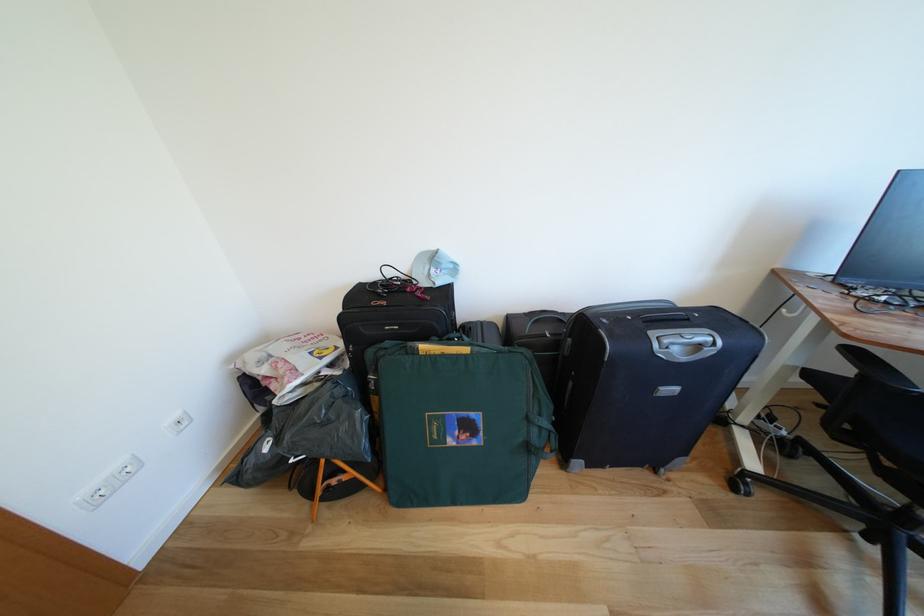
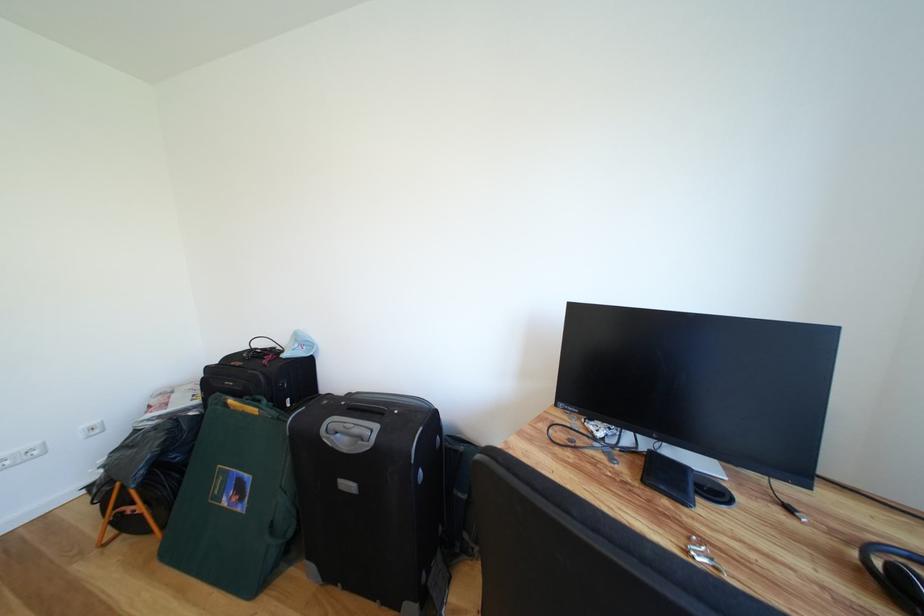
Find the pixel in the second image that matches point (691, 363) in the first image.

(353, 455)